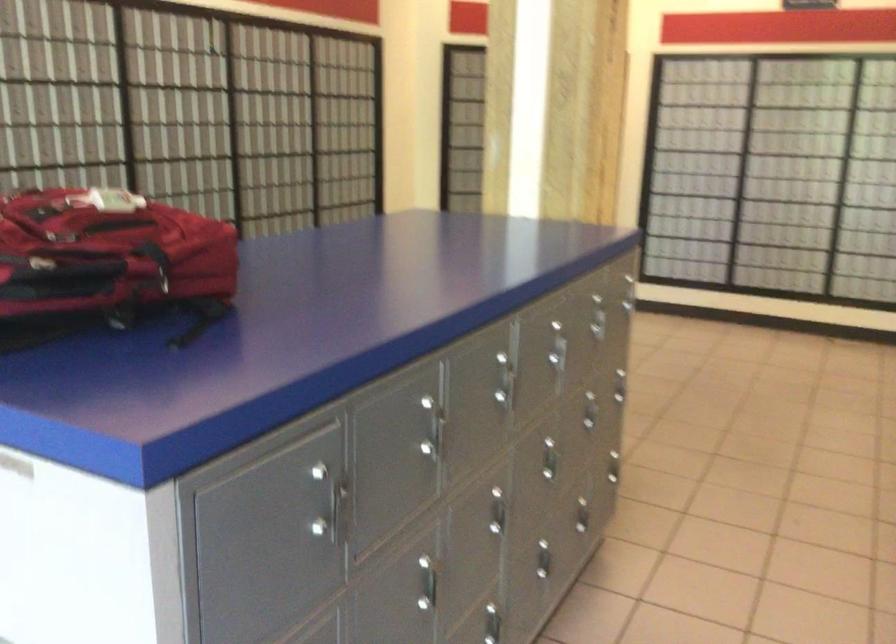
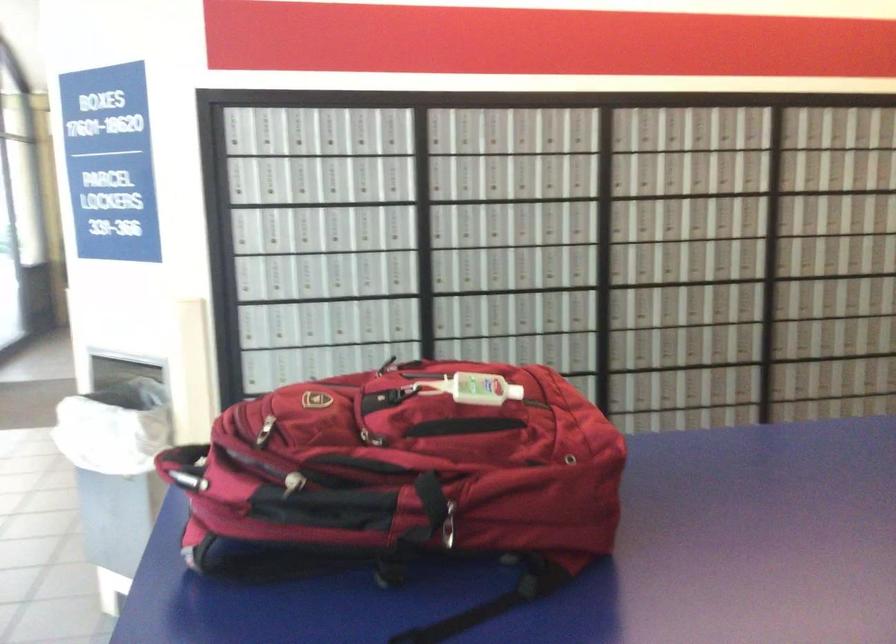
In the second image, find the point that corresponds to point 170,272 in the first image.

(446, 524)